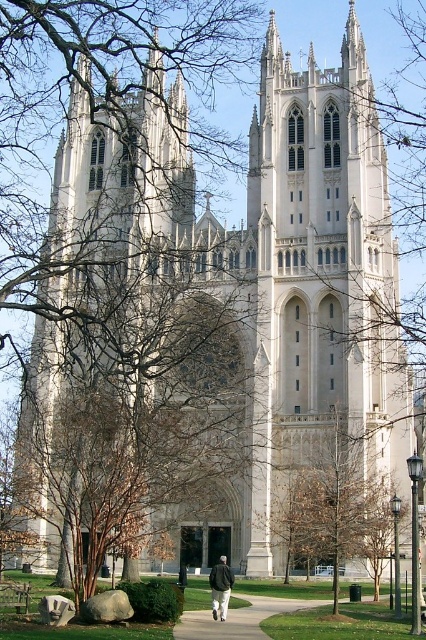
Who is taller, brown leafy tree at center or concrete sidewalk at lower center?

With more height is brown leafy tree at center.

Who is higher up, brown leafy tree at center or concrete sidewalk at lower center?

brown leafy tree at center

This screenshot has width=426, height=640. Describe the element at coordinates (333, 506) in the screenshot. I see `brown leafy tree at center` at that location.

Locate an element on the screen. brown leafy tree at center is located at coordinates (333, 506).

Is brown leafy tree at center behind dark gray jacket at center?

Yes, it is.

Can you confirm if brown leafy tree at center is wider than dark gray jacket at center?

Correct, the width of brown leafy tree at center exceeds that of dark gray jacket at center.

Is point (339, 499) closer to camera compared to point (219, 582)?

No, it is not.

This screenshot has width=426, height=640. What are the coordinates of `brown leafy tree at center` in the screenshot? It's located at (333, 506).

Is concrete sidewalk at lower center wider than dark gray jacket at center?

Correct, the width of concrete sidewalk at lower center exceeds that of dark gray jacket at center.

Can you confirm if concrete sidewalk at lower center is shorter than dark gray jacket at center?

Yes.

Between point (282, 604) and point (221, 614), which one is positioned behind?

The point (282, 604) is behind.

You are a GUI agent. You are given a task and a screenshot of the screen. Output one action in this format:
    pyautogui.click(x=<x>, y=<y>)
    Task: Click on the concrete sidewalk at lower center
    
    Given the screenshot: What is the action you would take?
    pyautogui.click(x=238, y=618)